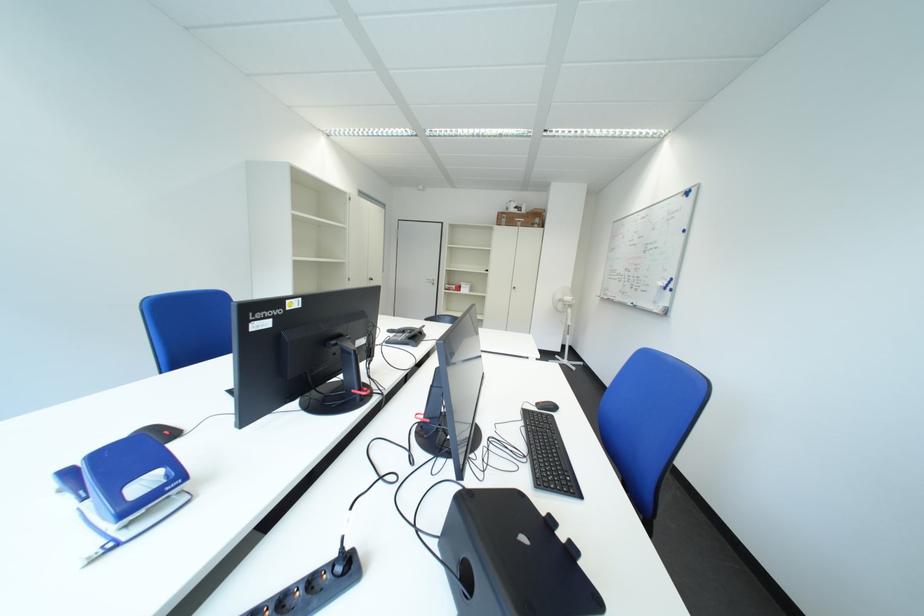
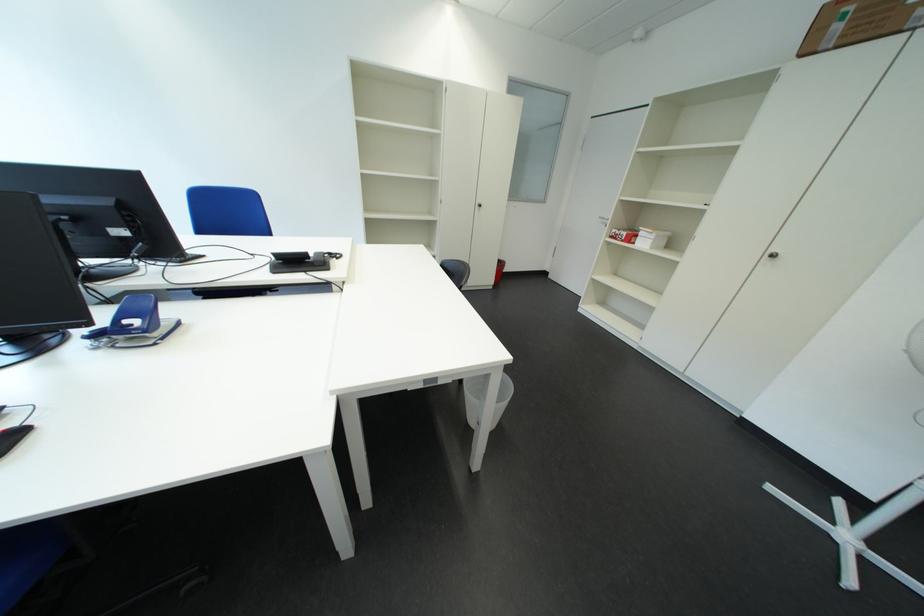
Where in the second image is the point corresponding to (478,293) from the first image?

(657, 246)